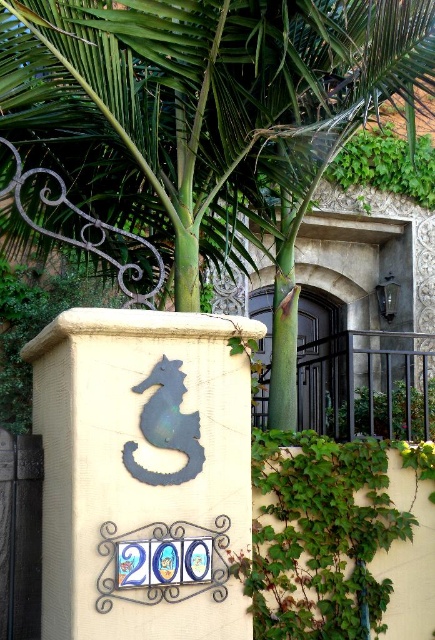
Question: Is green leafy palm tree at center thinner than black wrought iron gate at center?

Choices:
 (A) yes
 (B) no

Answer: (B)

Question: Among these objects, which one is farthest from the camera?

Choices:
 (A) green leafy palm tree at center
 (B) black wrought iron gate at center

Answer: (B)

Question: Does green leafy palm tree at center come behind black wrought iron gate at center?

Choices:
 (A) no
 (B) yes

Answer: (A)

Question: Is the position of green leafy palm tree at center more distant than that of black wrought iron gate at center?

Choices:
 (A) yes
 (B) no

Answer: (B)